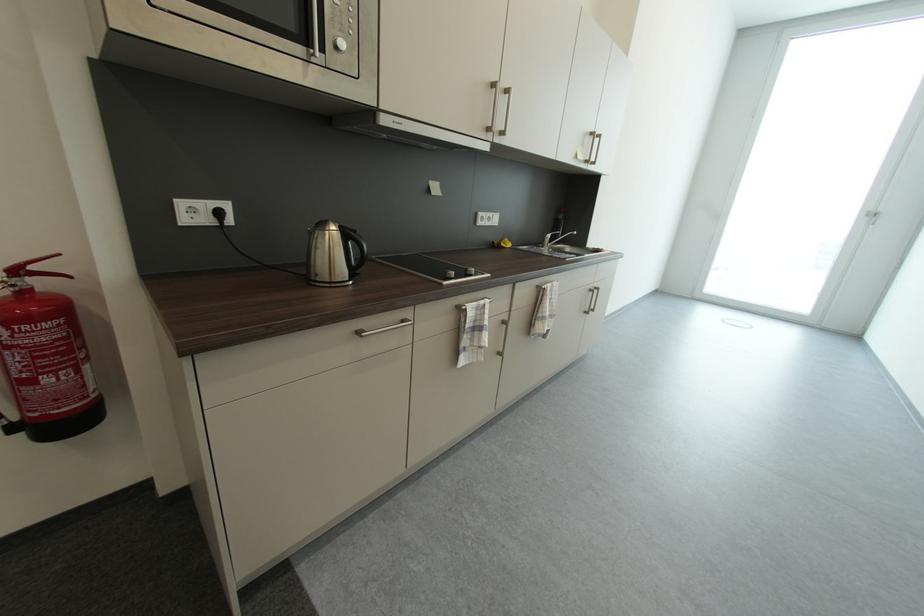
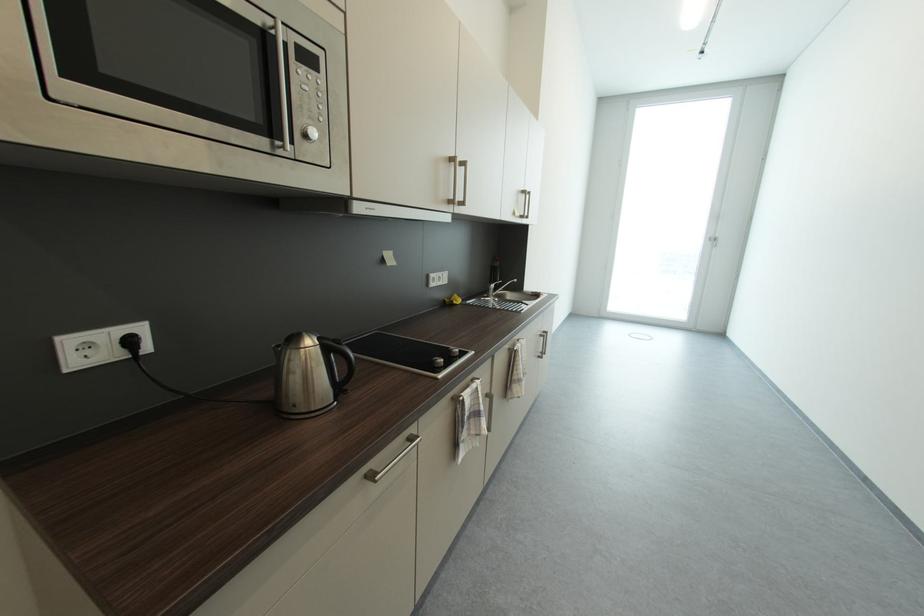
The point at (346, 228) is marked in the first image. Where is the corresponding point in the second image?

(323, 342)